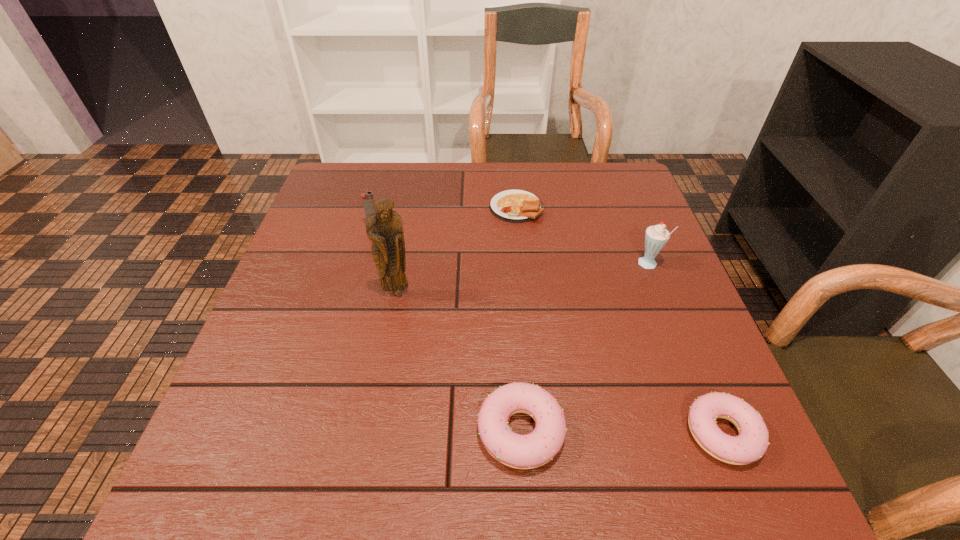
This screenshot has height=540, width=960. Identify the location of the left doughnut. (533, 450).

I want to click on the fourth tallest object, so click(533, 450).

Where is `the shorter doughnut`? the shorter doughnut is located at coordinates (750, 445).

Find the location of a particular element. The height and width of the screenshot is (540, 960). the fifth tallest object is located at coordinates (750, 445).

Where is `the shortest object`? Image resolution: width=960 pixels, height=540 pixels. the shortest object is located at coordinates (513, 205).

Find the location of a particular element. This screenshot has height=540, width=960. the leftmost object is located at coordinates pos(367,198).

Identify the location of igniter. (367, 198).

This screenshot has height=540, width=960. Find the location of `the fourth nearest object`. the fourth nearest object is located at coordinates (656, 237).

Find the location of a particular element. Image resolution: width=960 pixels, height=540 pixels. milkshake is located at coordinates (656, 237).

The image size is (960, 540). Identify the location of figurine. (384, 228).